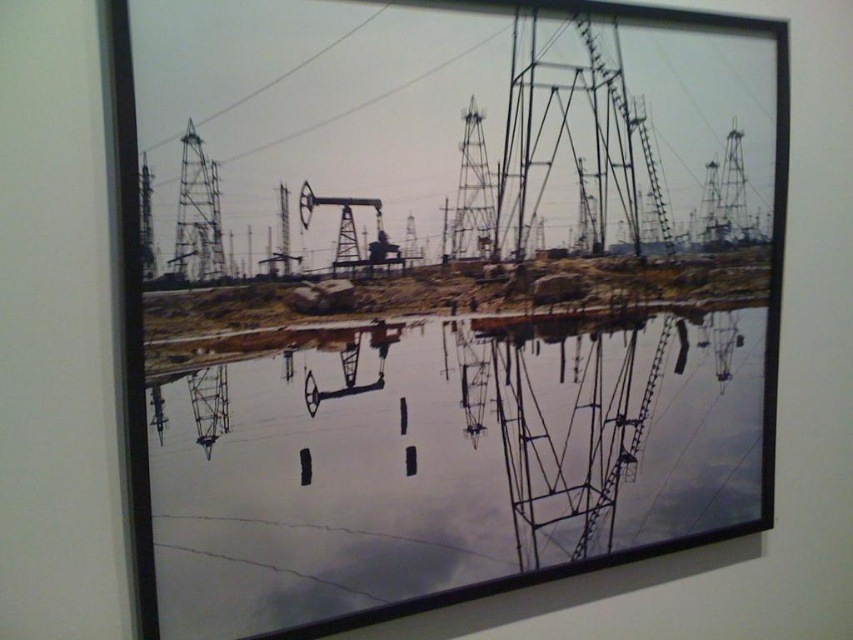
This screenshot has height=640, width=853. What do you see at coordinates (442, 464) in the screenshot?
I see `transparent glass water at center` at bounding box center [442, 464].

Does point (579, 378) lie in front of point (354, 26)?

No, (579, 378) is further to viewer.

You are a GUI agent. You are given a task and a screenshot of the screen. Output one action in this format:
    pyautogui.click(x=<x>, y=<y>)
    Task: Click on the transparent glass water at center
    This screenshot has width=853, height=640.
    Given the screenshot: What is the action you would take?
    pyautogui.click(x=442, y=464)

Which of these two, metallic wire at upper center or metallic wire at upper left, stands taller?

With more height is metallic wire at upper center.

Between point (401, 90) and point (347, 33), which one is positioned in front?

Point (347, 33) is more forward.

This screenshot has height=640, width=853. What are the coordinates of `metallic wire at upper center` in the screenshot? It's located at (368, 99).

Does transparent glass water at center appear under metallic wire at upper center?

Indeed, transparent glass water at center is positioned under metallic wire at upper center.

Who is positioned more to the left, transparent glass water at center or metallic wire at upper center?

metallic wire at upper center

Is point (332, 524) farther from camera compared to point (244, 152)?

Yes, point (332, 524) is farther from viewer.

The height and width of the screenshot is (640, 853). In order to click on transparent glass water at center in this screenshot , I will do `click(442, 464)`.